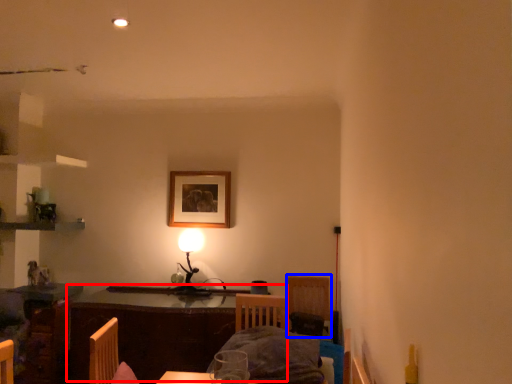
Question: Which point is further to the camera, table (highlighted by a red box) or armchair (highlighted by a blue box)?

Choices:
 (A) table
 (B) armchair

Answer: (B)